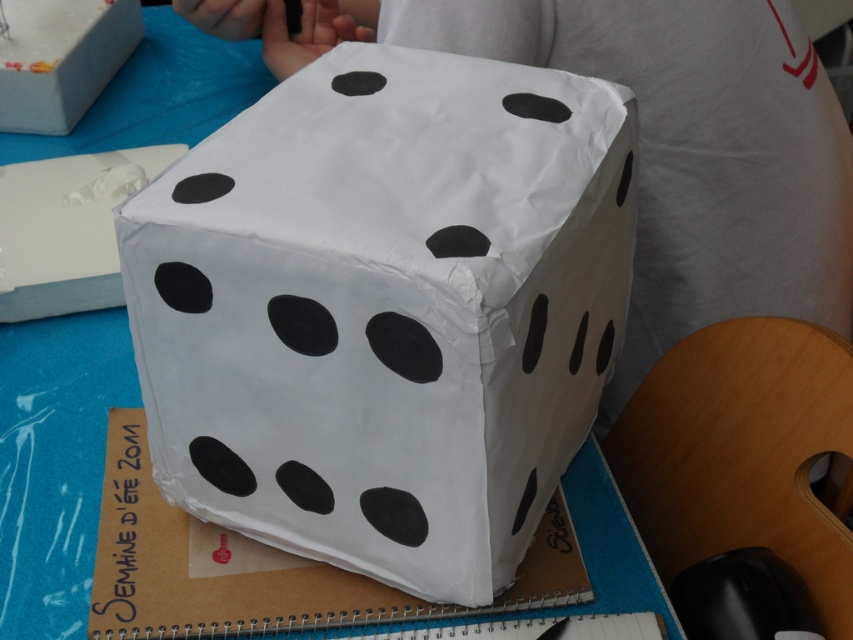
Is white paper dice at center taller than white paper box at upper left?

Correct, white paper dice at center is much taller as white paper box at upper left.

Does white paper dice at center appear under white paper box at upper left?

Yes, white paper dice at center is below white paper box at upper left.

I want to click on white paper dice at center, so click(x=386, y=308).

Find the location of a particular element. white paper dice at center is located at coordinates (386, 308).